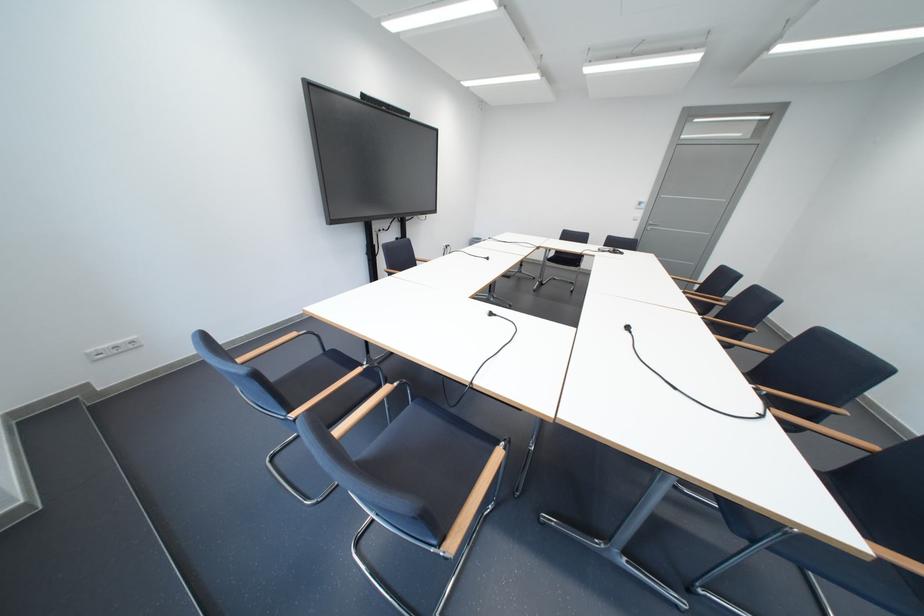
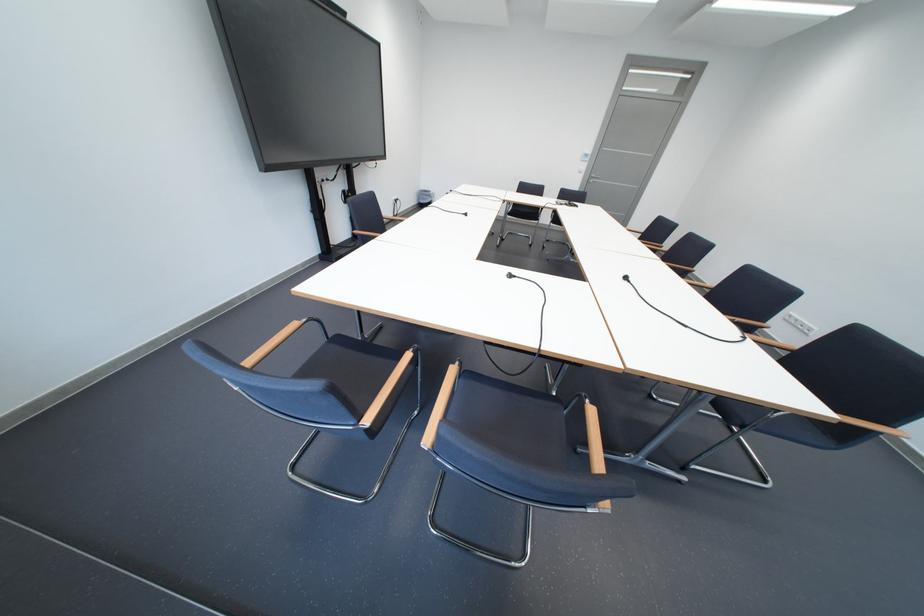
Locate, in the second image, the point that corresponds to pixel 650 216 in the first image.

(596, 168)